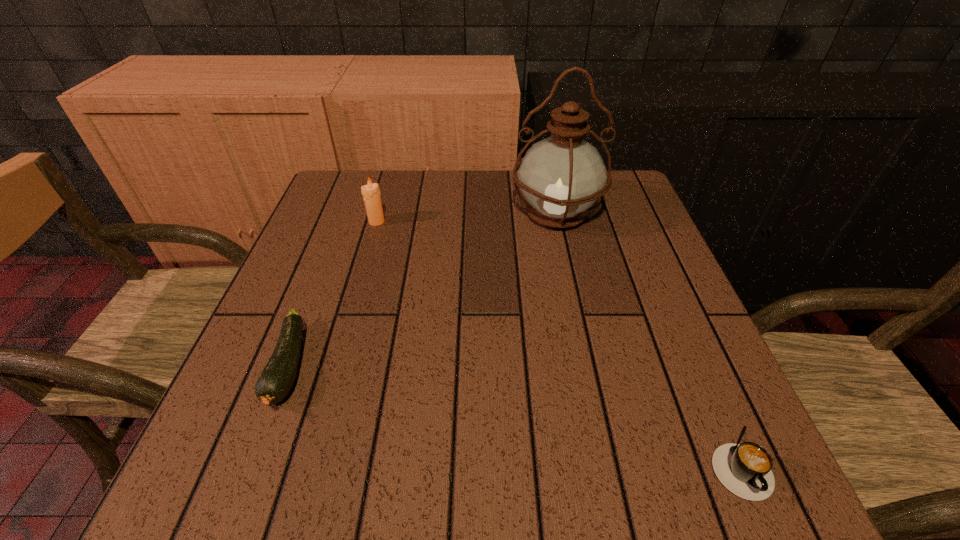
You are a GUI agent. You are given a task and a screenshot of the screen. Output one action in this format:
    pyautogui.click(x=<x>, y=<y>)
    Task: Click on the free space between the oil lamp and the second object from left to right
    This screenshot has width=960, height=540.
    Given the screenshot: What is the action you would take?
    pyautogui.click(x=467, y=218)

This screenshot has height=540, width=960. In order to click on vacant area that lies between the third shortest object and the third farthest object in this screenshot , I will do `click(333, 294)`.

Image resolution: width=960 pixels, height=540 pixels. In order to click on free point between the second object from left to right and the third object from left to right in this screenshot , I will do `click(467, 218)`.

Locate an element on the screen. The width and height of the screenshot is (960, 540). free spot between the cappuccino and the candle is located at coordinates (557, 342).

Find the location of a particular element. empty location between the zucchini and the tallest object is located at coordinates tap(422, 291).

The width and height of the screenshot is (960, 540). I want to click on free spot between the zucchini and the third object from right to left, so click(x=333, y=294).

At what (x,y) coordinates should I click in order to perform the action: click on empty space that is in between the oil lamp and the cappuccino. Please return your answer as a coordinate pair (x, y). This screenshot has width=960, height=540. Looking at the image, I should click on (646, 338).

At what (x,y) coordinates should I click in order to perform the action: click on object that stands as the second closest to the candle. Please return your answer as a coordinate pair (x, y). Image resolution: width=960 pixels, height=540 pixels. Looking at the image, I should click on (561, 176).

Identify which object is located as the nearest to the rightmost object. Please provide its 2D coordinates. Your answer should be formatted as a tuple, i.e. [(x, y)], where the tuple contains the x and y coordinates of a point satisfying the conditions above.

[(561, 176)]